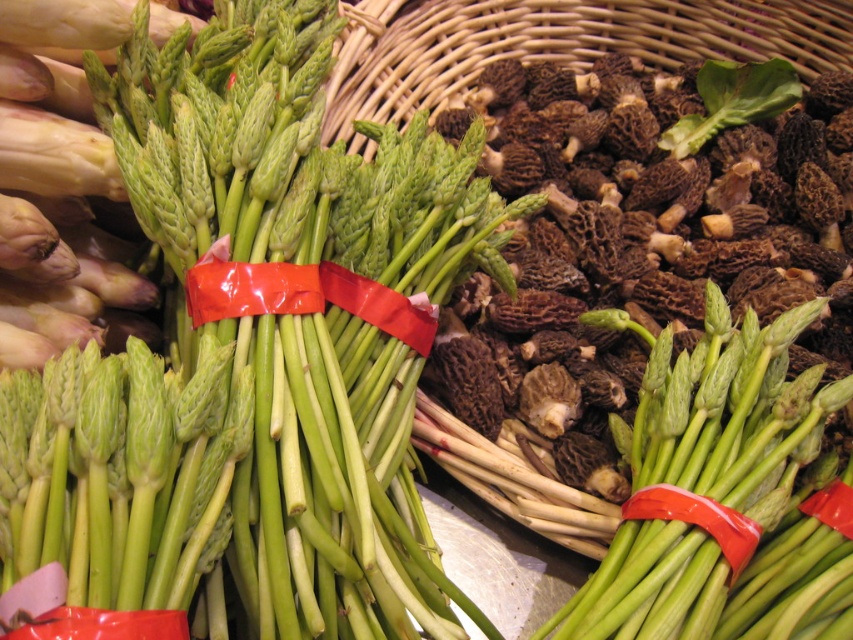
Question: Does red plastic ribbon at center appear on the left side of red rubber band at center?

Choices:
 (A) yes
 (B) no

Answer: (A)

Question: Which object appears closest to the camera in this image?

Choices:
 (A) red plastic ribbon at center
 (B) red rubber band at center

Answer: (B)

Question: Is red plastic ribbon at center wider than red rubber band at center?

Choices:
 (A) yes
 (B) no

Answer: (A)

Question: Is red plastic ribbon at center smaller than red rubber band at center?

Choices:
 (A) no
 (B) yes

Answer: (A)